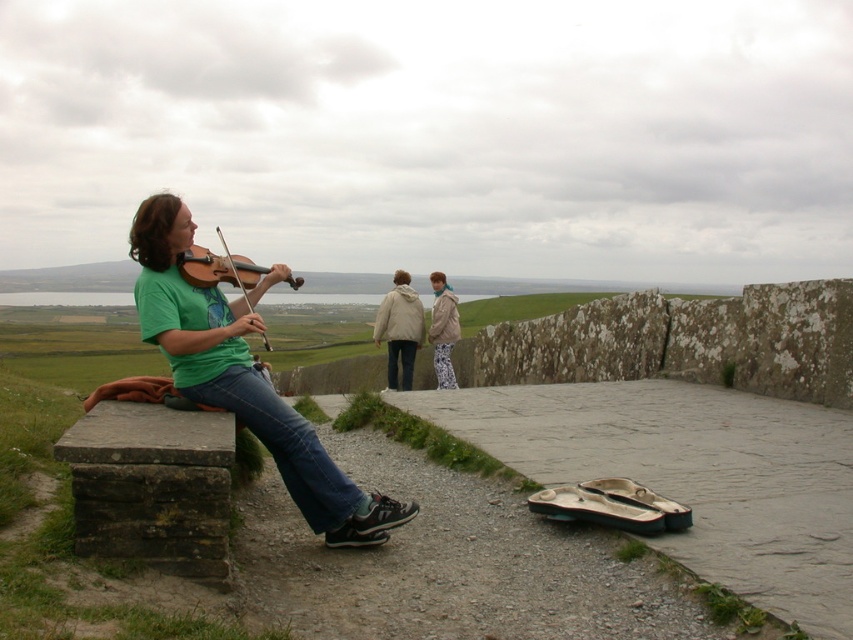
You are a photographer trying to capture a photo of the light beige jacket at center and blue denim jeans at center. Since you want to ensure both subjects are in focus, you need to know which one is taller. Can you determine which is taller?

The light beige jacket at center is much taller than the blue denim jeans at center, so you should focus on the light beige jacket at center first as it is taller.

You are an artist planning to paint this scene. You want to ensure the green matte shirt at left and the blue denim jeans at center are proportionally accurate. Which object should you make wider in your painting?

The green matte shirt at left should be made wider in the painting since its width surpasses that of the blue denim jeans at center.

You are a photographer trying to capture a group photo of the light beige jacket at center and the blue denim jeans at center. Since you want to ensure both subjects are in focus, which subject should you focus on to account for their size difference?

The light beige jacket at center is larger in size than the blue denim jeans at center, so focusing on the light beige jacket at center will ensure both subjects are in focus as it is the larger subject.